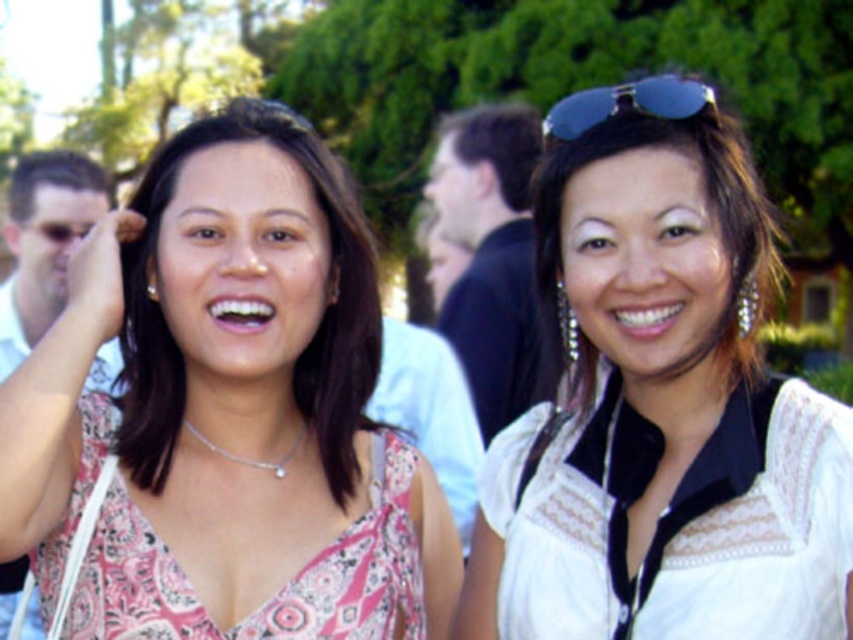
You are a photographer trying to capture a closeup of both the white lace blouse at center and the blue reflective sunglasses at upper right. Since the camera can only focus on one object at a time, which object should you choose to ensure it appears clearer in the photo?

The white lace blouse at center is larger in size than the blue reflective sunglasses at upper right, so it will be easier to focus on the white lace blouse at center for a clearer closeup.

You are a photographer trying to capture a closeup of the white lace blouse at center and the blue reflective sunglasses at upper right. Since you want both items to be in focus, which one should you focus on first to ensure proper depth of field?

The white lace blouse at center is much taller than the blue reflective sunglasses at upper right, so you should focus on the white lace blouse at center first to ensure both are in focus.

You are a photographer adjusting your camera settings. You want to focus on the white lace blouse at center. What coordinates should you set to ensure the blouse is in sharp focus?

You should set the coordinates to point (660, 403) to focus on the white lace blouse at center.